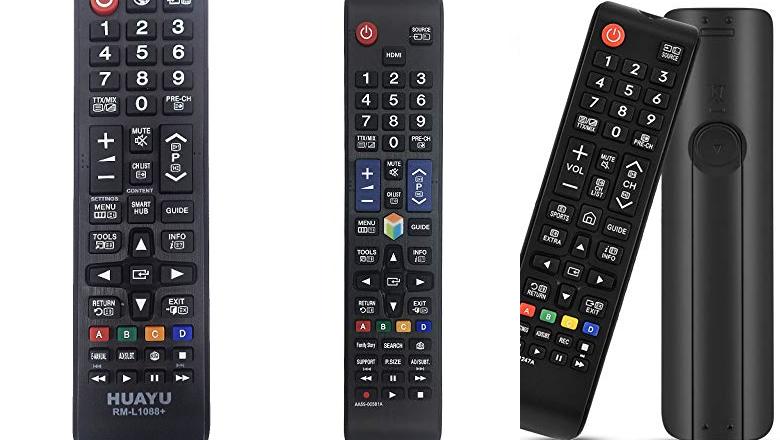
This screenshot has height=440, width=780. What are the coordinates of `directional buttons on the 3rd remote` in the screenshot? It's located at (580, 247), (547, 261), (566, 295), (604, 284).